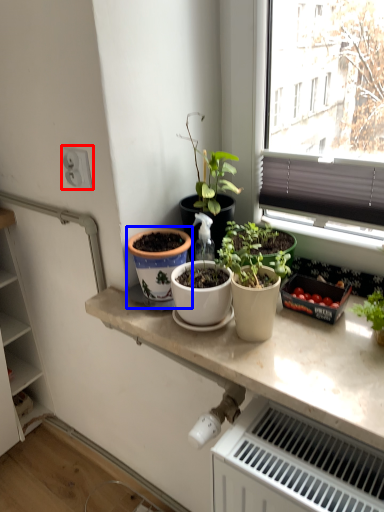
Question: Which point is further to the camera, electric outlet (highlighted by a red box) or flowerpot (highlighted by a blue box)?

Choices:
 (A) electric outlet
 (B) flowerpot

Answer: (A)